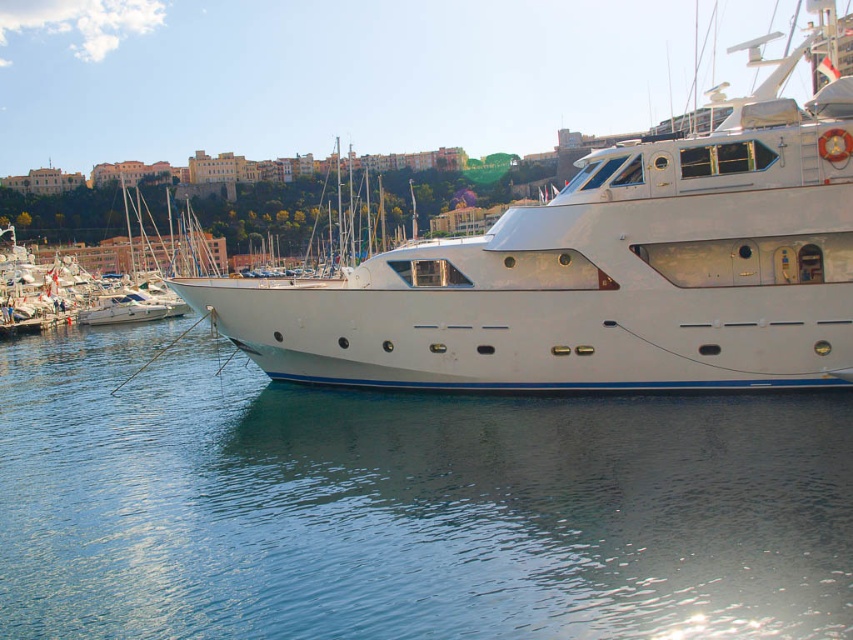
This screenshot has height=640, width=853. I want to click on clear blue water at lower center, so click(405, 506).